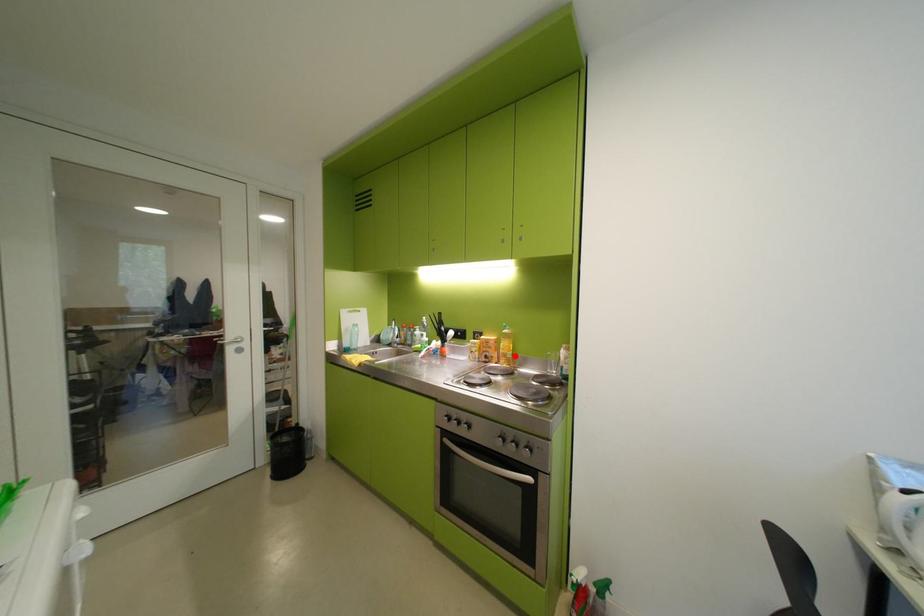
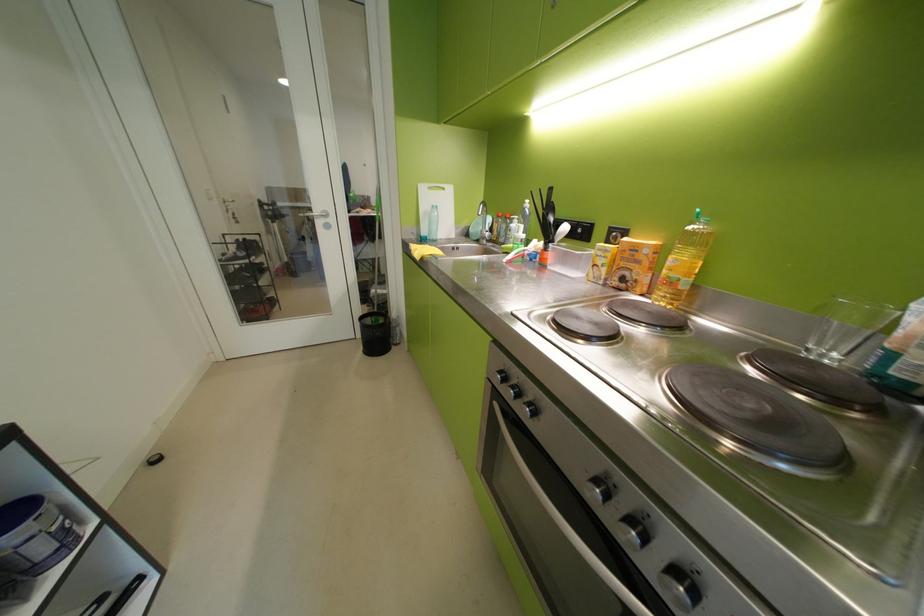
Question: I am providing you with two images of the same scene from different viewpoints. A red point is shown in image1. For the corresponding object point in image2, is it positioned nearer or farther from the camera?

Choices:
 (A) Nearer
 (B) Farther

Answer: (A)